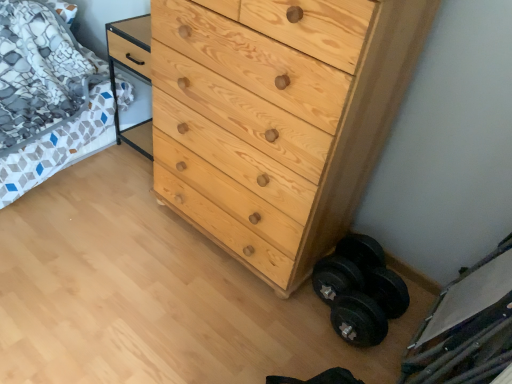
In the scene shown: In order to face natural wood chest of drawers at center, should I rotate leftwards or rightwards?

Turn right by 1.612 degrees to look at natural wood chest of drawers at center.

The height and width of the screenshot is (384, 512). Find the location of `black rubber dumbbell at lower right`. black rubber dumbbell at lower right is located at coordinates (360, 290).

I want to click on chest of drawers above the black rubber dumbbell at lower right (from the image's perspective), so click(x=277, y=118).

Is black rubber dumbbell at lower right to the left of natural wood chest of drawers at center from the viewer's perspective?

No.

What's the angular difference between patterned fabric bed at left and black rubber dumbbell at lower right's facing directions?

2.87 degrees separate the facing orientations of patterned fabric bed at left and black rubber dumbbell at lower right.

Is patterned fabric bed at left smaller than black rubber dumbbell at lower right?

No, patterned fabric bed at left is not smaller than black rubber dumbbell at lower right.

Which of these two, patterned fabric bed at left or black rubber dumbbell at lower right, is thinner?

Thinner between the two is black rubber dumbbell at lower right.

Which point is more forward, (x=64, y=130) or (x=333, y=321)?

Positioned in front is point (x=333, y=321).

Would you consider natural wood chest of drawers at center to be distant from black rubber dumbbell at lower right?

natural wood chest of drawers at center is actually quite close to black rubber dumbbell at lower right.

Is natural wood chest of drawers at center taller than black rubber dumbbell at lower right?

Yes, natural wood chest of drawers at center is taller than black rubber dumbbell at lower right.

Between natural wood chest of drawers at center and black rubber dumbbell at lower right, which one has larger width?

Wider between the two is natural wood chest of drawers at center.

From a real-world perspective, is natural wood chest of drawers at center physically located above or below black rubber dumbbell at lower right?

From a real-world perspective, natural wood chest of drawers at center is physically above black rubber dumbbell at lower right.

Is black rubber dumbbell at lower right positioned beyond the bounds of patterned fabric bed at left?

black rubber dumbbell at lower right is positioned outside patterned fabric bed at left.

Which of these two, black rubber dumbbell at lower right or patterned fabric bed at left, is thinner?

black rubber dumbbell at lower right is thinner.

From a real-world perspective, who is located lower, black rubber dumbbell at lower right or patterned fabric bed at left?

black rubber dumbbell at lower right is physically lower.

Which is correct: patterned fabric bed at left is inside natural wood chest of drawers at center, or outside of it?

patterned fabric bed at left lies outside natural wood chest of drawers at center.

Considering the sizes of objects patterned fabric bed at left and natural wood chest of drawers at center in the image provided, who is smaller, patterned fabric bed at left or natural wood chest of drawers at center?

natural wood chest of drawers at center is smaller.

This screenshot has width=512, height=384. Identify the location of chest of drawers to the right of patterned fabric bed at left. (277, 118).

Who is shorter, patterned fabric bed at left or natural wood chest of drawers at center?

patterned fabric bed at left.

Is natural wood chest of drawers at center wider than patterned fabric bed at left?

Incorrect, the width of natural wood chest of drawers at center does not surpass that of patterned fabric bed at left.

Which is correct: natural wood chest of drawers at center is inside patterned fabric bed at left, or outside of it?

The correct answer is: outside.

Which is behind, natural wood chest of drawers at center or patterned fabric bed at left?

patterned fabric bed at left is more distant.

Which of these two, natural wood chest of drawers at center or patterned fabric bed at left, stands shorter?

With less height is patterned fabric bed at left.

This screenshot has width=512, height=384. Identify the location of chest of drawers on the left of black rubber dumbbell at lower right. (277, 118).

Identify the location of dumbbell on the right of patterned fabric bed at left. Image resolution: width=512 pixels, height=384 pixels. (360, 290).

From the image, which object appears to be farther from patterned fabric bed at left, black rubber dumbbell at lower right or natural wood chest of drawers at center?

black rubber dumbbell at lower right.

Estimate the real-world distances between objects in this image. Which object is further from natural wood chest of drawers at center, patterned fabric bed at left or black rubber dumbbell at lower right?

Based on the image, patterned fabric bed at left appears to be further to natural wood chest of drawers at center.

From the picture: From the image, which object appears to be nearer to black rubber dumbbell at lower right, patterned fabric bed at left or natural wood chest of drawers at center?

Among the two, natural wood chest of drawers at center is located nearer to black rubber dumbbell at lower right.

Considering their positions, is natural wood chest of drawers at center positioned further to patterned fabric bed at left than black rubber dumbbell at lower right?

The object further to patterned fabric bed at left is black rubber dumbbell at lower right.

From the image, which object appears to be nearer to natural wood chest of drawers at center, black rubber dumbbell at lower right or patterned fabric bed at left?

The object closer to natural wood chest of drawers at center is black rubber dumbbell at lower right.

Based on the photo, considering their positions, is natural wood chest of drawers at center positioned closer to black rubber dumbbell at lower right than patterned fabric bed at left?

Based on the image, natural wood chest of drawers at center appears to be nearer to black rubber dumbbell at lower right.

I want to click on the chest of drawers located between patterned fabric bed at left and black rubber dumbbell at lower right in the left-right direction, so click(277, 118).